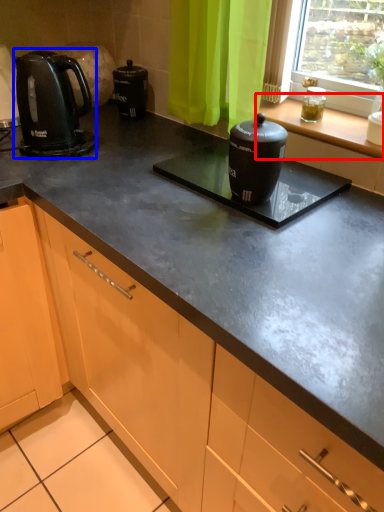
Question: Among these objects, which one is farthest to the camera, window sill (highlighted by a red box) or kitchen appliance (highlighted by a blue box)?

Choices:
 (A) window sill
 (B) kitchen appliance

Answer: (B)